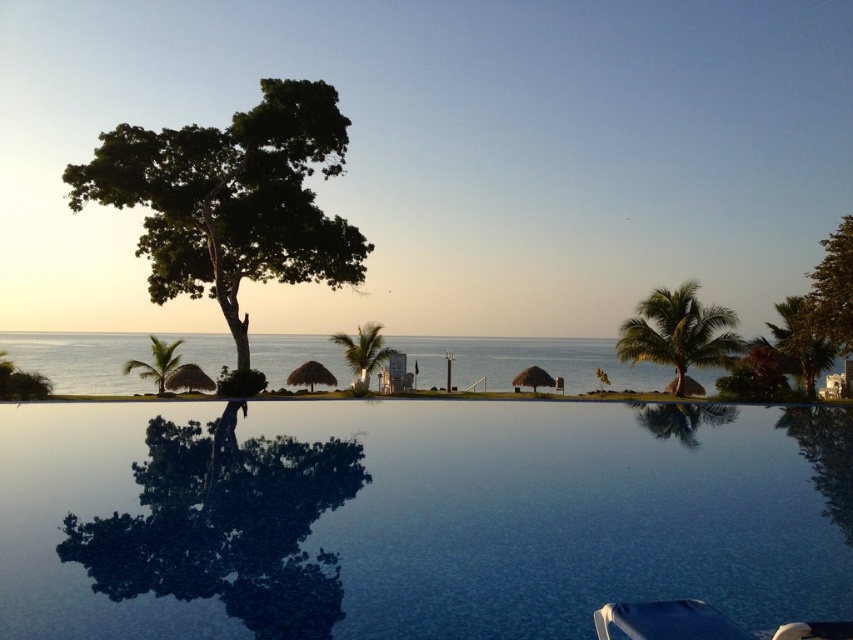
In the scene shown: Can you confirm if white plastic beach chair at lower right is thinner than green leafy palm tree at center?

Indeed, white plastic beach chair at lower right has a lesser width compared to green leafy palm tree at center.

This screenshot has width=853, height=640. I want to click on white plastic beach chair at lower right, so click(666, 620).

Who is positioned more to the right, green leafy palm tree at upper right or green leafy palm tree at left?

green leafy palm tree at upper right

Between point (729, 349) and point (165, 385), which one is positioned behind?

The point (165, 385) is more distant.

Between point (732, 353) and point (143, 362), which one is positioned in front?

Point (732, 353)

At what (x,y) coordinates should I click in order to perform the action: click on green leafy palm tree at upper right. Please return your answer as a coordinate pair (x, y). Image resolution: width=853 pixels, height=640 pixels. Looking at the image, I should click on (679, 333).

In the scene shown: How distant is transparent glass pool at center from green leafy palm tree at center?

transparent glass pool at center is 50.98 feet from green leafy palm tree at center.

Which of these two, transparent glass pool at center or green leafy palm tree at center, stands taller?

green leafy palm tree at center

Does point (405, 460) come farther from viewer compared to point (355, 340)?

No, it is not.

Locate an element on the screen. This screenshot has width=853, height=640. transparent glass pool at center is located at coordinates (415, 516).